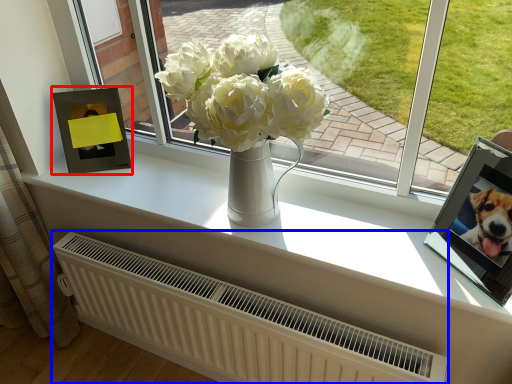
Question: Which object appears closest to the camera in this image, picture frame (highlighted by a red box) or radiator (highlighted by a blue box)?

Choices:
 (A) picture frame
 (B) radiator

Answer: (B)